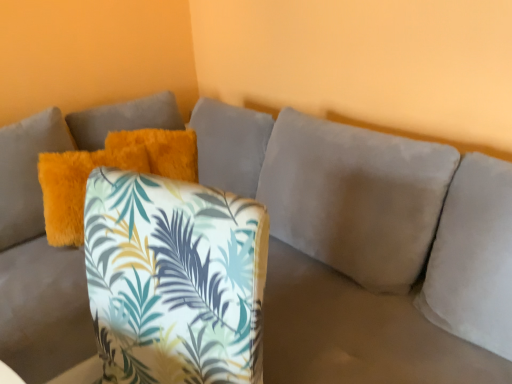
The image size is (512, 384). What do you see at coordinates (174, 279) in the screenshot?
I see `printed fabric cushion at center` at bounding box center [174, 279].

The width and height of the screenshot is (512, 384). I want to click on printed fabric cushion at center, so click(174, 279).

In order to click on fluffy orange pillow at upper left in this screenshot , I will do `click(108, 166)`.

Describe the element at coordinates (108, 166) in the screenshot. I see `fluffy orange pillow at upper left` at that location.

Find the location of `printed fabric cushion at center`. printed fabric cushion at center is located at coordinates click(174, 279).

Is fluffy orange pillow at upper left at the right side of printed fabric cushion at center?

No, fluffy orange pillow at upper left is not to the right of printed fabric cushion at center.

In the image, is fluffy orange pillow at upper left positioned in front of or behind printed fabric cushion at center?

Clearly, fluffy orange pillow at upper left is behind printed fabric cushion at center.

Does point (69, 158) come farther from viewer compared to point (223, 342)?

Yes, it is behind point (223, 342).

In the scene shown: From the image's perspective, is fluffy orange pillow at upper left located above printed fabric cushion at center?

Yes, from the image's perspective, fluffy orange pillow at upper left is over printed fabric cushion at center.

From a real-world perspective, who is located higher, fluffy orange pillow at upper left or printed fabric cushion at center?

fluffy orange pillow at upper left, from a real-world perspective.

Does fluffy orange pillow at upper left have a lesser width compared to printed fabric cushion at center?

Yes, fluffy orange pillow at upper left is thinner than printed fabric cushion at center.

Is fluffy orange pillow at upper left taller or shorter than printed fabric cushion at center?

Clearly, fluffy orange pillow at upper left is shorter compared to printed fabric cushion at center.

Between fluffy orange pillow at upper left and printed fabric cushion at center, which one has larger size?

Bigger between the two is printed fabric cushion at center.

Would you say fluffy orange pillow at upper left is inside or outside printed fabric cushion at center?

The correct answer is: outside.

Does fluffy orange pillow at upper left touch printed fabric cushion at center?

No, fluffy orange pillow at upper left is not beside printed fabric cushion at center.

Is fluffy orange pillow at upper left looking in the opposite direction of printed fabric cushion at center?

No.

I want to click on throw pillow in front of the fluffy orange pillow at upper left, so click(174, 279).

In the image, is printed fabric cushion at center on the left side or the right side of fluffy orange pillow at upper left?

In the image, printed fabric cushion at center appears on the right side of fluffy orange pillow at upper left.

Which is in front, printed fabric cushion at center or fluffy orange pillow at upper left?

printed fabric cushion at center is more forward.

Does point (200, 228) come behind point (86, 178)?

No, (200, 228) is closer to viewer.

From the image's perspective, is printed fabric cushion at center on top of fluffy orange pillow at upper left?

No.

From a real-world perspective, which is physically below, printed fabric cushion at center or fluffy orange pillow at upper left?

printed fabric cushion at center.

Consider the image. Is printed fabric cushion at center thinner than fluffy orange pillow at upper left?

In fact, printed fabric cushion at center might be wider than fluffy orange pillow at upper left.

Who is shorter, printed fabric cushion at center or fluffy orange pillow at upper left?

fluffy orange pillow at upper left.

Which of these two, printed fabric cushion at center or fluffy orange pillow at upper left, is bigger?

printed fabric cushion at center is bigger.

Can fluffy orange pillow at upper left be found inside printed fabric cushion at center?

Actually, fluffy orange pillow at upper left is outside printed fabric cushion at center.

Would you consider printed fabric cushion at center to be distant from fluffy orange pillow at upper left?

That's not correct — printed fabric cushion at center is a little close to fluffy orange pillow at upper left.

Is printed fabric cushion at center looking in the opposite direction of fluffy orange pillow at upper left?

printed fabric cushion at center does not have its back to fluffy orange pillow at upper left.

How different are the orientations of printed fabric cushion at center and fluffy orange pillow at upper left in degrees?

69.3 degrees.

Locate an element on the screen. The image size is (512, 384). throw pillow that appears below the fluffy orange pillow at upper left (from the image's perspective) is located at coordinates (174, 279).

At what (x,y) coordinates should I click in order to perform the action: click on pillow lying on the left of printed fabric cushion at center. Please return your answer as a coordinate pair (x, y). Looking at the image, I should click on (108, 166).

Where is `throw pillow that is below the fluffy orange pillow at upper left (from the image's perspective)`? throw pillow that is below the fluffy orange pillow at upper left (from the image's perspective) is located at coordinates (174, 279).